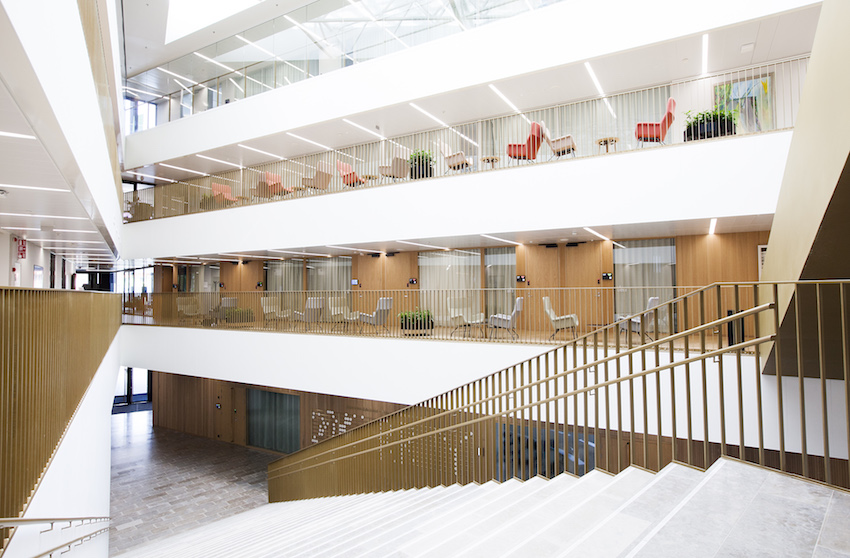
Image resolution: width=850 pixels, height=558 pixels. In order to click on floors / levels of building in this screenshot , I will do `click(206, 99)`, `click(218, 187)`, `click(224, 286)`, `click(180, 447)`.